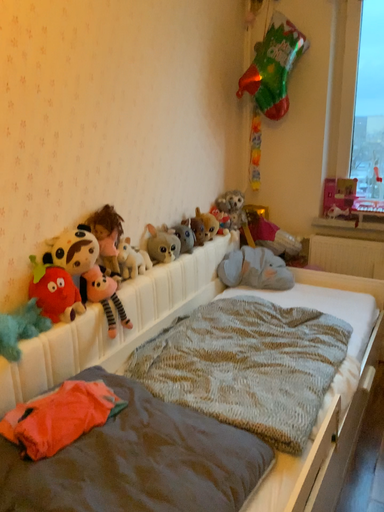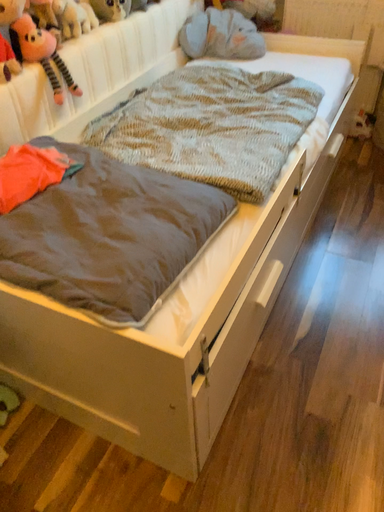
Question: Which way did the camera rotate in the video?

Choices:
 (A) rotated downward
 (B) rotated upward

Answer: (A)